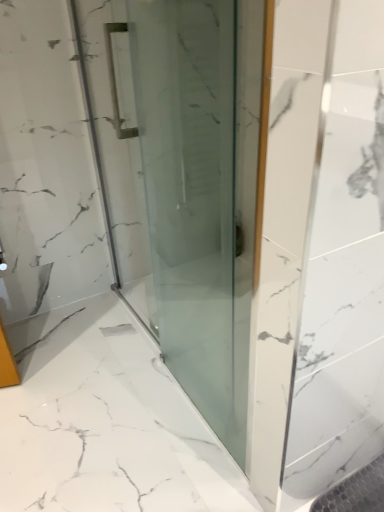
Question: Considering the relative positions of transparent glass door at center and transparent glass shower at center in the image provided, is transparent glass door at center to the left or to the right of transparent glass shower at center?

Choices:
 (A) left
 (B) right

Answer: (A)

Question: Considering their positions, is transparent glass door at center located in front of or behind transparent glass shower at center?

Choices:
 (A) front
 (B) behind

Answer: (A)

Question: Based on their sizes in the image, would you say transparent glass door at center is bigger or smaller than transparent glass shower at center?

Choices:
 (A) small
 (B) big

Answer: (A)

Question: Based on their sizes in the image, would you say transparent glass shower at center is bigger or smaller than transparent glass door at center?

Choices:
 (A) small
 (B) big

Answer: (B)

Question: From their relative heights in the image, would you say transparent glass shower at center is taller or shorter than transparent glass door at center?

Choices:
 (A) short
 (B) tall

Answer: (A)

Question: Would you say transparent glass shower at center is to the left or to the right of transparent glass door at center in the picture?

Choices:
 (A) right
 (B) left

Answer: (A)

Question: From a real-world perspective, is transparent glass shower at center above or below transparent glass door at center?

Choices:
 (A) below
 (B) above

Answer: (A)